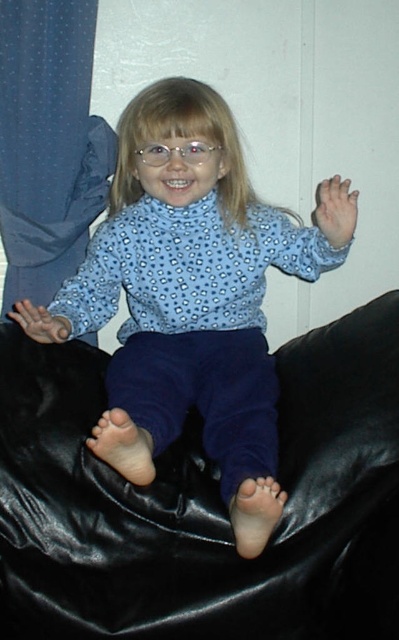
Can you confirm if blue dotted shirt at center is positioned above clear plastic glasses at center?

Actually, blue dotted shirt at center is below clear plastic glasses at center.

Is point (152, 324) in front of point (148, 163)?

That is False.

Locate an element on the screen. The height and width of the screenshot is (640, 399). blue dotted shirt at center is located at coordinates tap(193, 300).

Find the location of a particular element. The width and height of the screenshot is (399, 640). blue dotted shirt at center is located at coordinates (193, 300).

Who is shorter, black leather bean bag chair at center or blue dotted shirt at center?

With less height is black leather bean bag chair at center.

Locate an element on the screen. Image resolution: width=399 pixels, height=640 pixels. black leather bean bag chair at center is located at coordinates (203, 502).

Does black leather bean bag chair at center have a greater height compared to blue fabric curtain at left?

Incorrect, black leather bean bag chair at center's height is not larger of blue fabric curtain at left's.

Who is higher up, black leather bean bag chair at center or blue fabric curtain at left?

Positioned higher is blue fabric curtain at left.

Is point (387, 467) positioned before point (84, 108)?

Yes, point (387, 467) is in front of point (84, 108).

This screenshot has height=640, width=399. Identify the location of black leather bean bag chair at center. (203, 502).